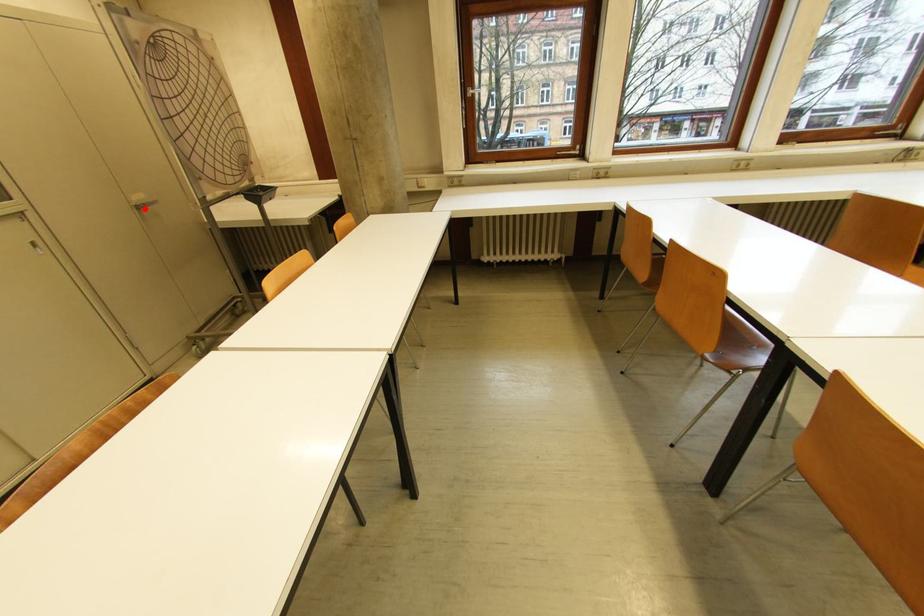
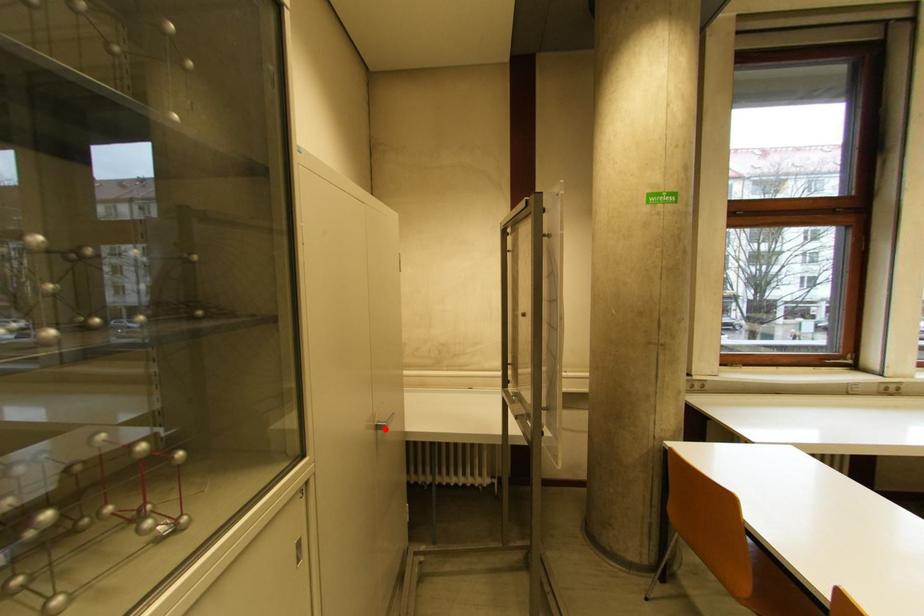
I am providing you with two images of the same scene from different viewpoints. A red point is marked on the first image and another point is marked on the second image. Is the marked point in image1 the same physical position as the marked point in image2?

Yes